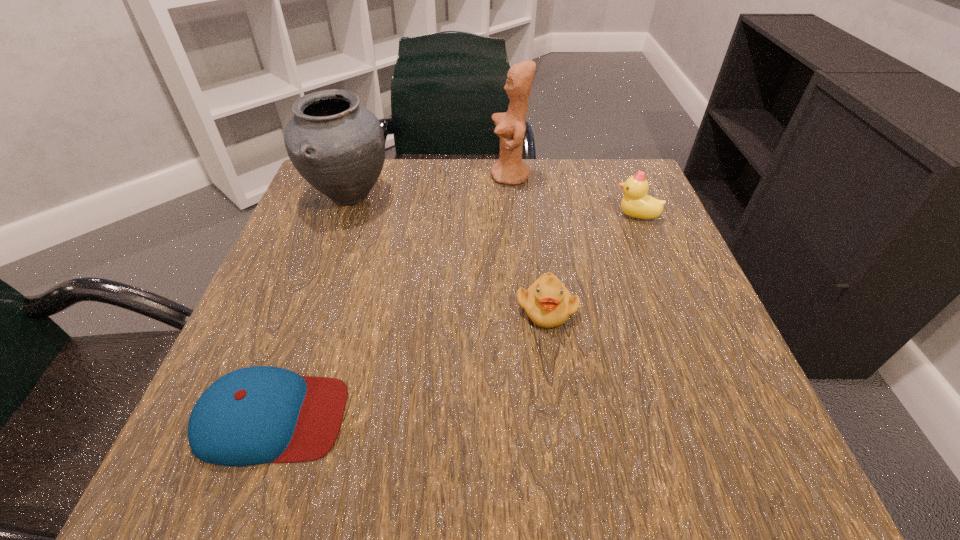
At what (x,y) coordinates should I click in order to perform the action: click on object that is at the near edge. Please return your answer as a coordinate pair (x, y). This screenshot has height=540, width=960. Looking at the image, I should click on (255, 415).

I want to click on urn that is at the left edge, so click(x=337, y=145).

Identify the location of baseball cap that is positioned at the left edge. (255, 415).

This screenshot has width=960, height=540. I want to click on object that is positioned at the right edge, so click(636, 203).

At what (x,y) coordinates should I click in order to perform the action: click on object present at the far left corner. Please return your answer as a coordinate pair (x, y). The height and width of the screenshot is (540, 960). Looking at the image, I should click on (337, 145).

You are a GUI agent. You are given a task and a screenshot of the screen. Output one action in this format:
    pyautogui.click(x=<x>, y=<y>)
    Task: Click on the object that is at the near left corner
    The image size is (960, 540).
    Given the screenshot: What is the action you would take?
    pyautogui.click(x=255, y=415)

The image size is (960, 540). What are the coordinates of `object located at the far right corner` in the screenshot? It's located at (636, 203).

You are a GUI agent. You are given a task and a screenshot of the screen. Output one action in this format:
    pyautogui.click(x=<x>, y=<y>)
    Task: Click on the vacant region at the far edge of the desktop
    
    Given the screenshot: What is the action you would take?
    pyautogui.click(x=471, y=209)

At what (x,y) coordinates should I click in order to perform the action: click on blank space at the left edge of the desktop. Please return your answer as a coordinate pair (x, y). The image size is (960, 540). Looking at the image, I should click on click(363, 253).

This screenshot has height=540, width=960. Identify the location of vacant space at the right edge of the desktop. [685, 267].